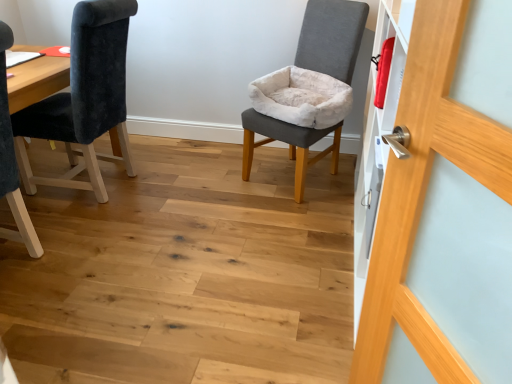
Identify the location of vacant area in front of velvet dark blue chair at left, which is the 1th chair in left-to-right order. Image resolution: width=512 pixels, height=384 pixels. (106, 230).